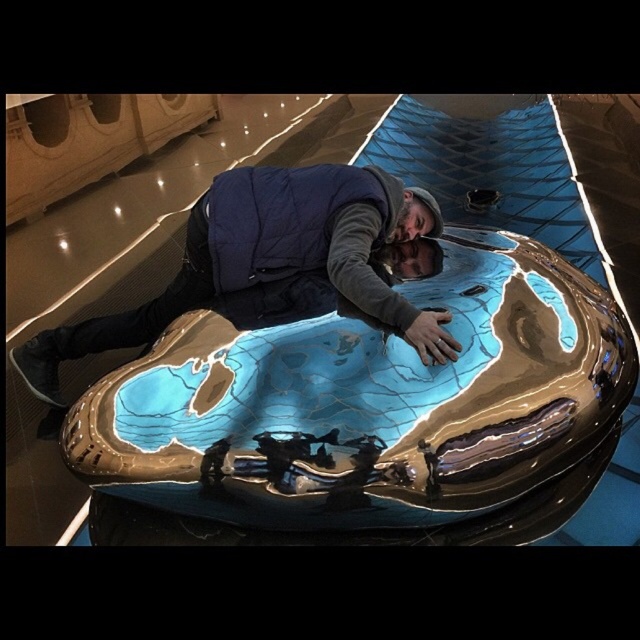
Question: Which of the following is the farthest from the observer?

Choices:
 (A) metallic blue pool at center
 (B) blue metallic man at center
 (C) navy blue down vest at center

Answer: (C)

Question: Can you confirm if metallic blue pool at center is bigger than blue metallic man at center?

Choices:
 (A) yes
 (B) no

Answer: (A)

Question: Among these objects, which one is farthest from the camera?

Choices:
 (A) navy blue down vest at center
 (B) blue metallic man at center
 (C) metallic blue pool at center

Answer: (A)

Question: Can you confirm if blue metallic man at center is smaller than navy blue down vest at center?

Choices:
 (A) yes
 (B) no

Answer: (B)

Question: Is blue metallic man at center bigger than navy blue down vest at center?

Choices:
 (A) no
 (B) yes

Answer: (B)

Question: Among these points, which one is farthest from the camera?

Choices:
 (A) (371, 284)
 (B) (452, 356)
 (C) (356, 419)

Answer: (A)